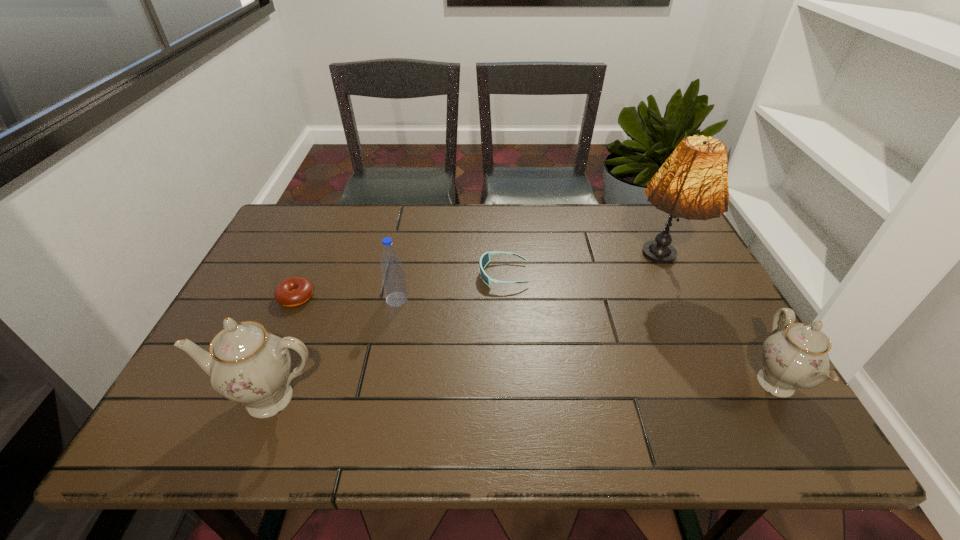
The image size is (960, 540). Identify the location of free space in the image that satisfies the following two spatial constraints: 1. on the front side of the fourth object from right to left; 2. on the right side of the doughnut. (296, 300).